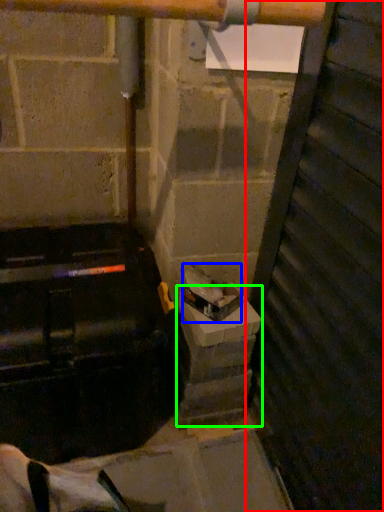
Question: Considering the real-world distances, which object is farthest from door (highlighted by a red box)? garbage (highlighted by a blue box) or concrete (highlighted by a green box)?

Choices:
 (A) garbage
 (B) concrete

Answer: (A)